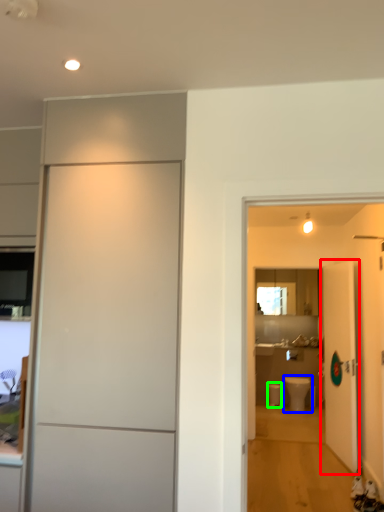
Question: Estimate the real-world distances between objects in this image. Which object is farther from door (highlighted by a red box), toilet (highlighted by a blue box) or toilet bowl (highlighted by a green box)?

Choices:
 (A) toilet
 (B) toilet bowl

Answer: (B)